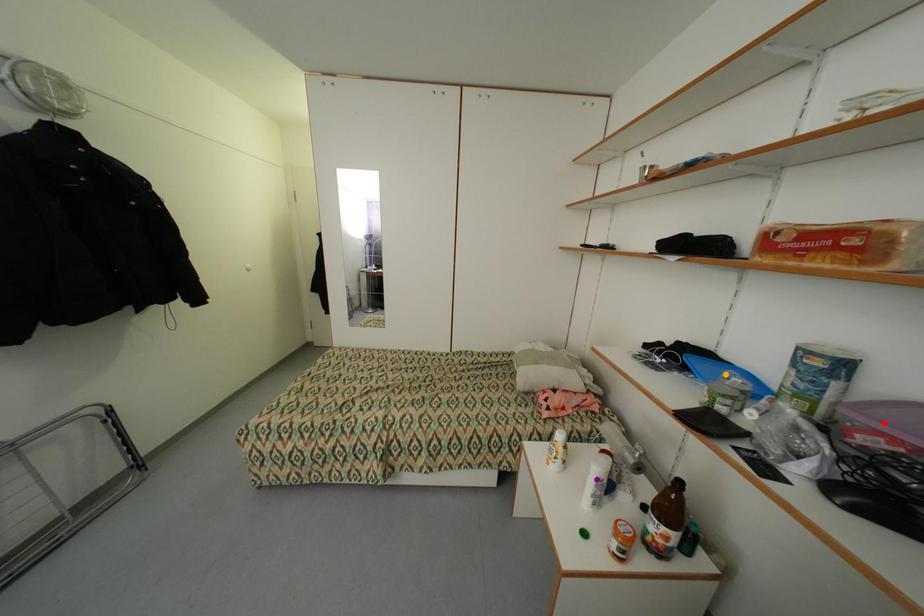
Order these from nearest to farthest:
A) purple point
B) orange point
C) red point

red point → orange point → purple point